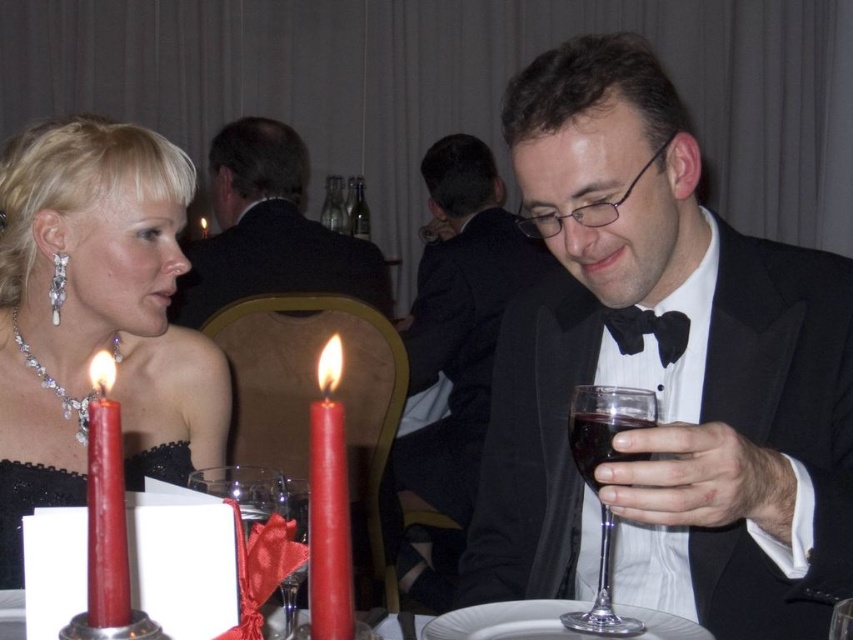
You are a photographer at a formal event and need to capture a closeup shot of both the red matte candle at left and the black satin bow tie at center. Given that your camera has a maximum focus range of 20 inches, will you be able to include both objects in the same frame without adjusting your position?

The red matte candle at left and the black satin bow tie at center are 22.86 inches apart, which exceeds the camera maximum focus range of 20 inches. Therefore, you will not be able to include both objects in the same frame without adjusting your position.

You are a photographer at a formal event. You need to capture a photo of the matte black suit at upper center and the dark red glass at right. Which object is closer to the camera?

The matte black suit at upper center is closer to the camera because it is positioned over the dark red glass at right, indicating it is in front of it.